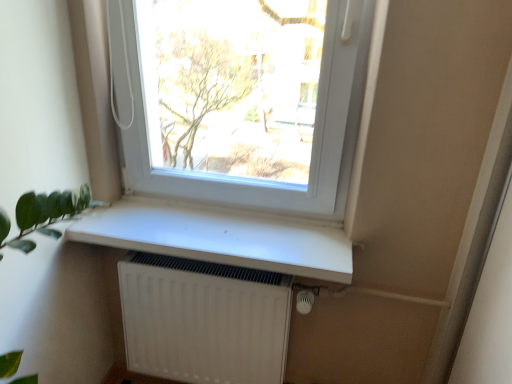
Where is `vacant region above white matte window sill at center (from a real-world perspective)`? vacant region above white matte window sill at center (from a real-world perspective) is located at coordinates (216, 228).